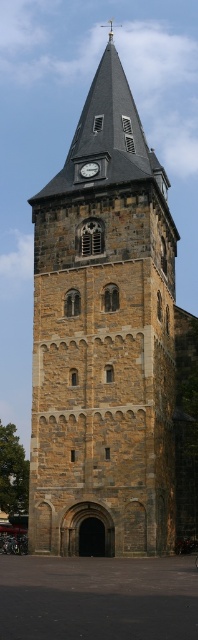
Question: Among these objects, which one is nearest to the camera?

Choices:
 (A) white clock face at upper center
 (B) brown stone church at center

Answer: (B)

Question: Does brown stone church at center appear on the left side of white clock face at upper center?

Choices:
 (A) yes
 (B) no

Answer: (B)

Question: Can you confirm if brown stone church at center is positioned to the right of white clock face at upper center?

Choices:
 (A) yes
 (B) no

Answer: (A)

Question: Which object is farther from the camera taking this photo?

Choices:
 (A) white clock face at upper center
 (B) brown stone church at center

Answer: (A)

Question: Is brown stone church at center to the right of white clock face at upper center from the viewer's perspective?

Choices:
 (A) no
 (B) yes

Answer: (B)